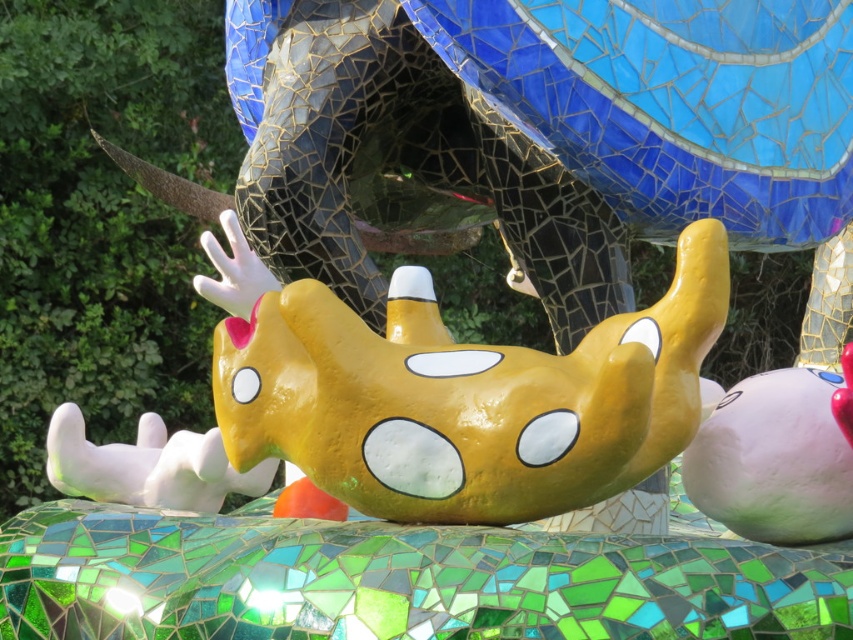
Which is behind, point (601, 406) or point (825, 468)?

Positioned behind is point (825, 468).

Does yellow matte toy at center appear over matte white plush at lower right?

Yes, yellow matte toy at center is above matte white plush at lower right.

Does point (293, 385) lie in front of point (752, 497)?

No, (293, 385) is further to viewer.

Locate an element on the screen. yellow matte toy at center is located at coordinates (456, 392).

Who is taller, yellow matte toy at center or white glossy paw at lower left?

yellow matte toy at center

Is yellow matte toy at center smaller than white glossy paw at lower left?

No, yellow matte toy at center is not smaller than white glossy paw at lower left.

At what (x,y) coordinates should I click in order to perform the action: click on yellow matte toy at center. Please return your answer as a coordinate pair (x, y). Image resolution: width=853 pixels, height=640 pixels. Looking at the image, I should click on (456, 392).

Find the location of `yellow matte toy at center`. yellow matte toy at center is located at coordinates (456, 392).

Is matte white plush at lower right in front of white glossy paw at lower left?

Yes, matte white plush at lower right is in front of white glossy paw at lower left.

Which is above, matte white plush at lower right or white glossy paw at lower left?

matte white plush at lower right is higher up.

Where is `matte white plush at lower right`? Image resolution: width=853 pixels, height=640 pixels. matte white plush at lower right is located at coordinates (778, 456).